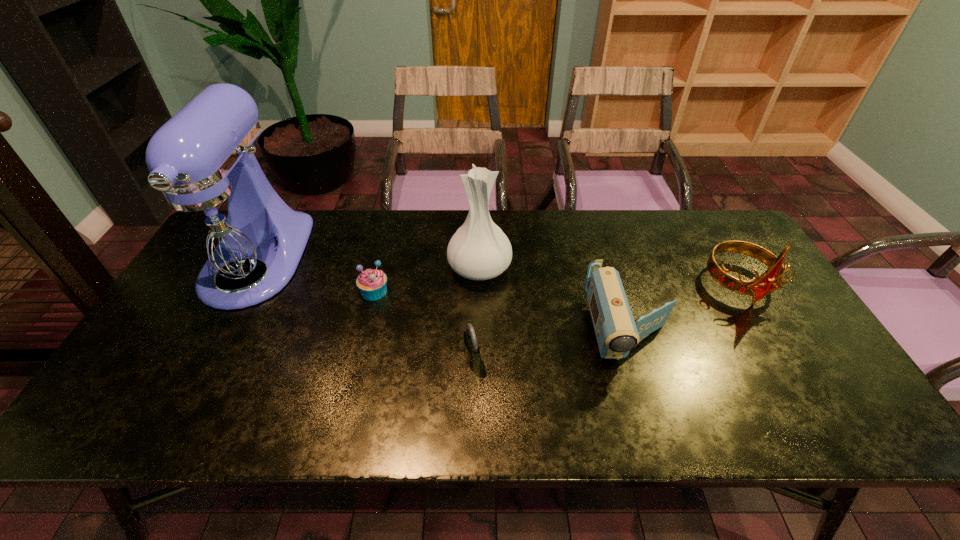
I want to click on vacant region between the mixer and the muffin, so click(315, 276).

The height and width of the screenshot is (540, 960). Find the location of `vacant space that is in between the camcorder and the mixer`. vacant space that is in between the camcorder and the mixer is located at coordinates (443, 296).

Where is `object that ranks as the closest to the second shortest object`? Image resolution: width=960 pixels, height=540 pixels. object that ranks as the closest to the second shortest object is located at coordinates (479, 250).

Find the location of a particular element. The image size is (960, 540). object that is the fourth closest to the fifth object from right to left is located at coordinates (617, 333).

The width and height of the screenshot is (960, 540). Identify the location of free region that satisfies the following two spatial constraints: 1. at the mixing area of the mixer; 2. on the right side of the fifth tallest object. (203, 359).

This screenshot has height=540, width=960. I want to click on free space that satisfies the following two spatial constraints: 1. at the mixing area of the tallest object; 2. on the right side of the padlock, so click(203, 359).

Identify the location of vacant point that satisfies the following two spatial constraints: 1. at the mixing area of the tallest object; 2. on the left side of the fifth shortest object. The height and width of the screenshot is (540, 960). (252, 268).

Where is `free region that satisfies the following two spatial constraints: 1. at the mixing area of the mixer; 2. on the left side of the vase`? The height and width of the screenshot is (540, 960). free region that satisfies the following two spatial constraints: 1. at the mixing area of the mixer; 2. on the left side of the vase is located at coordinates (252, 268).

Image resolution: width=960 pixels, height=540 pixels. Find the location of `vacant space that satisfies the following two spatial constraints: 1. at the mixing area of the fifth shortest object; 2. on the right side of the leftmost object`. vacant space that satisfies the following two spatial constraints: 1. at the mixing area of the fifth shortest object; 2. on the right side of the leftmost object is located at coordinates (252, 268).